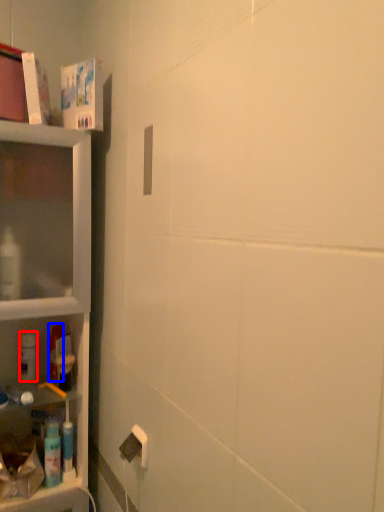
Question: Which of the following is the farthest to the observer, cleaning product (highlighted by a red box) or mouthwash (highlighted by a blue box)?

Choices:
 (A) cleaning product
 (B) mouthwash

Answer: (B)